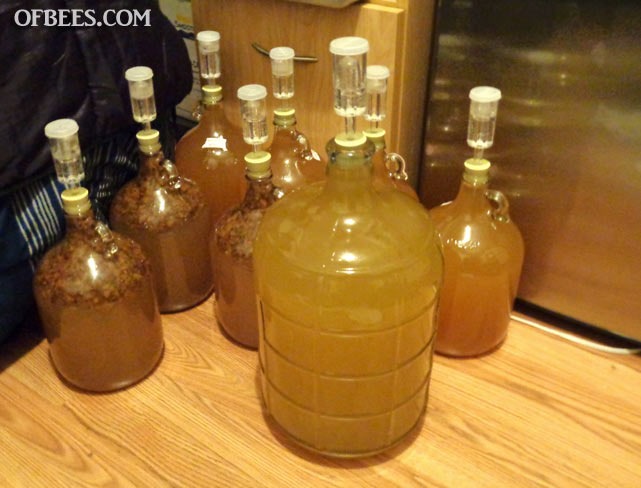
The width and height of the screenshot is (641, 488). Find the location of `bottle`. bottle is located at coordinates (246, 314).